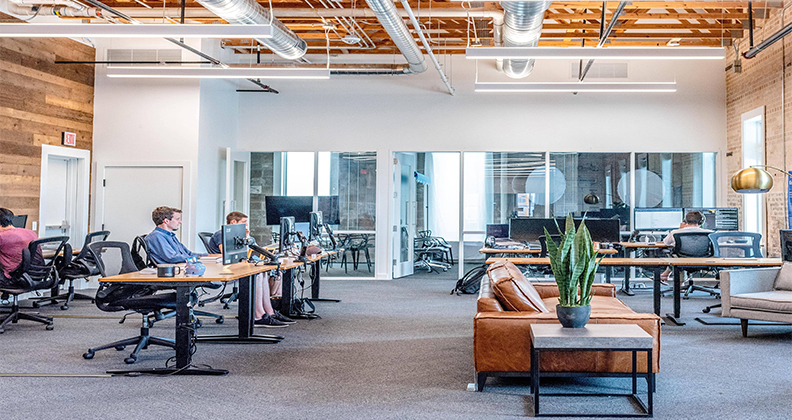
The width and height of the screenshot is (792, 420). What are the coordinates of `carpet` in the screenshot? It's located at pos(330,383).